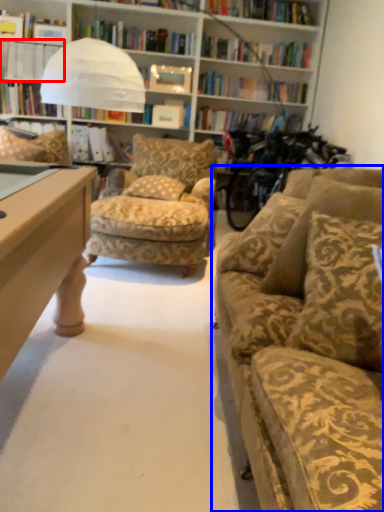
Question: Which of the following is the farthest to the observer, book (highlighted by a red box) or studio couch (highlighted by a blue box)?

Choices:
 (A) book
 (B) studio couch

Answer: (A)